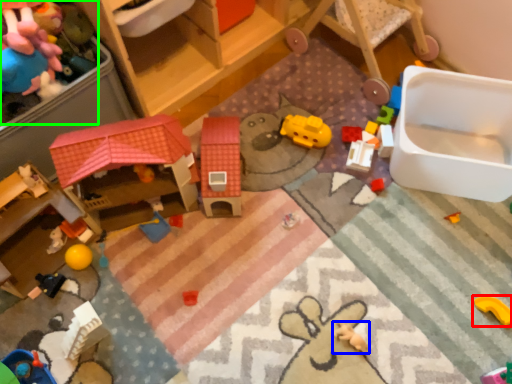
Question: Based on their relative distances, which object is nearer to toy (highlighted by a red box)? Choose from toy (highlighted by a blue box) and toy (highlighted by a green box).

Choices:
 (A) toy
 (B) toy

Answer: (A)